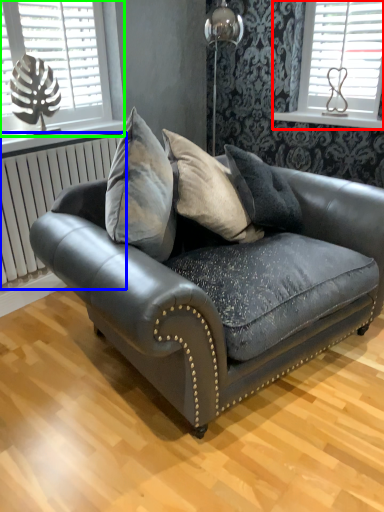
Question: Which object is positioned closest to window (highlighted by a red box)? Select from radiator (highlighted by a blue box) and window (highlighted by a green box).

Choices:
 (A) radiator
 (B) window

Answer: (B)